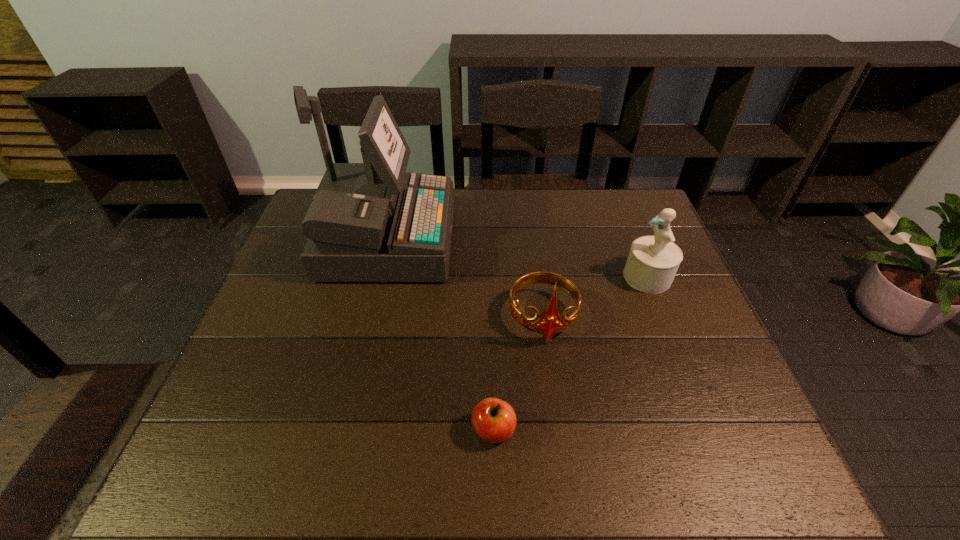
Image resolution: width=960 pixels, height=540 pixels. I want to click on free point between the tiara and the leftmost object, so click(x=465, y=280).

At what (x,y) coordinates should I click in order to perform the action: click on free space between the shortest object and the figurine. Please return your answer as a coordinate pair (x, y). Looking at the image, I should click on (570, 353).

Find the location of a particular element. free point between the apple and the rightmost object is located at coordinates (570, 353).

You are a GUI agent. You are given a task and a screenshot of the screen. Output one action in this format:
    pyautogui.click(x=<x>, y=<y>)
    Task: Click on the free spot between the leftmost object and the apple
    
    Given the screenshot: What is the action you would take?
    pyautogui.click(x=440, y=336)

What are the coordinates of `blank region between the apple and the tiara` in the screenshot? It's located at (518, 374).

In order to click on free area in between the tiara and the nearest object in this screenshot , I will do `click(518, 374)`.

This screenshot has width=960, height=540. In order to click on free point between the tiara and the figurine in this screenshot , I will do [595, 298].

Locate an element on the screen. Image resolution: width=960 pixels, height=540 pixels. blank region between the apple and the cash register is located at coordinates (440, 336).

Where is `empty location between the tiara and the cash register`? empty location between the tiara and the cash register is located at coordinates pos(465,280).

I want to click on free space between the tiara and the tallest object, so click(x=465, y=280).